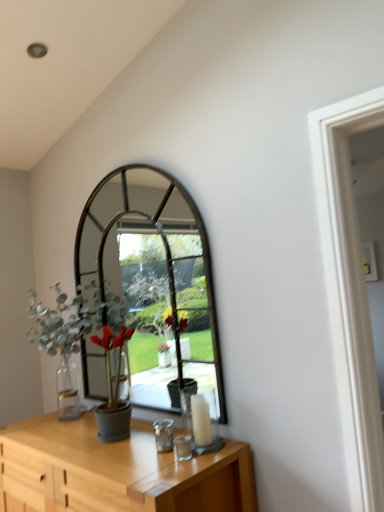
Where is `free spot to the right of white glass candle at center`? The image size is (384, 512). free spot to the right of white glass candle at center is located at coordinates (224, 446).